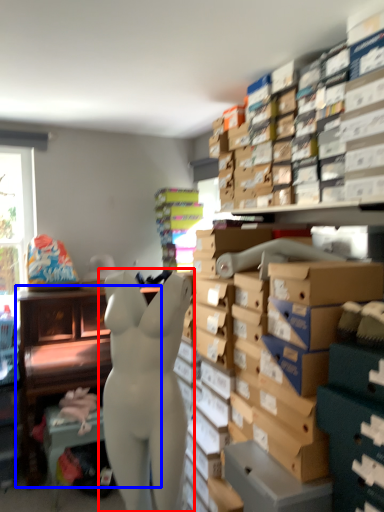
Question: Among these objects, which one is nearest to the camera, person (highlighted by a red box) or furniture (highlighted by a blue box)?

Choices:
 (A) person
 (B) furniture

Answer: (A)